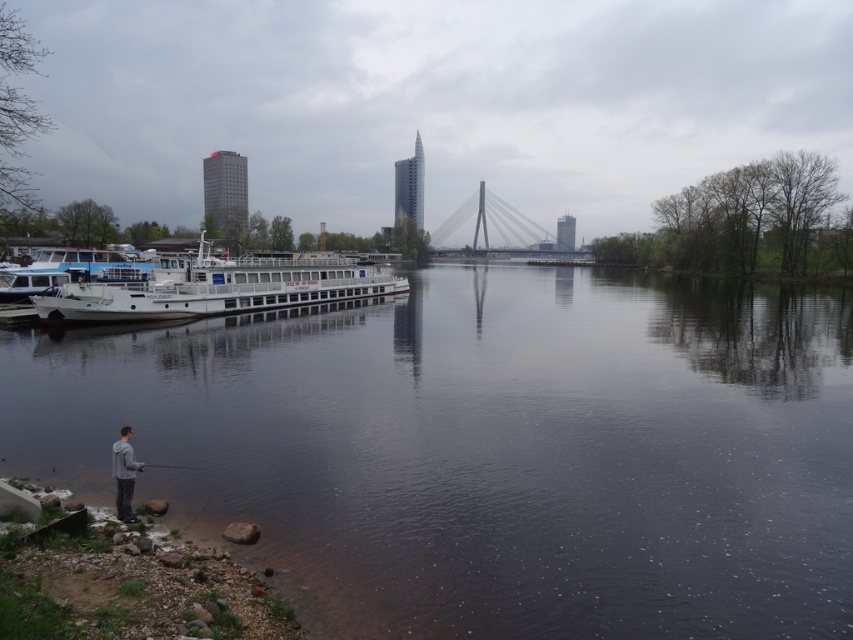
Question: Estimate the real-world distances between objects in this image. Which object is farther from the gray matte jacket at lower left?

Choices:
 (A) white glossy boat at left
 (B) dark reflective water at center

Answer: (A)

Question: Can you confirm if dark reflective water at center is bigger than gray matte jacket at lower left?

Choices:
 (A) yes
 (B) no

Answer: (A)

Question: Where is dark reflective water at center located in relation to white glossy boat at left in the image?

Choices:
 (A) right
 (B) left

Answer: (A)

Question: Which point appears closest to the camera in this image?

Choices:
 (A) (743, 492)
 (B) (128, 432)
 (C) (367, 284)

Answer: (B)

Question: Among these objects, which one is nearest to the camera?

Choices:
 (A) dark reflective water at center
 (B) gray matte jacket at lower left

Answer: (A)

Question: In this image, where is dark reflective water at center located relative to white glossy boat at left?

Choices:
 (A) right
 (B) left

Answer: (A)